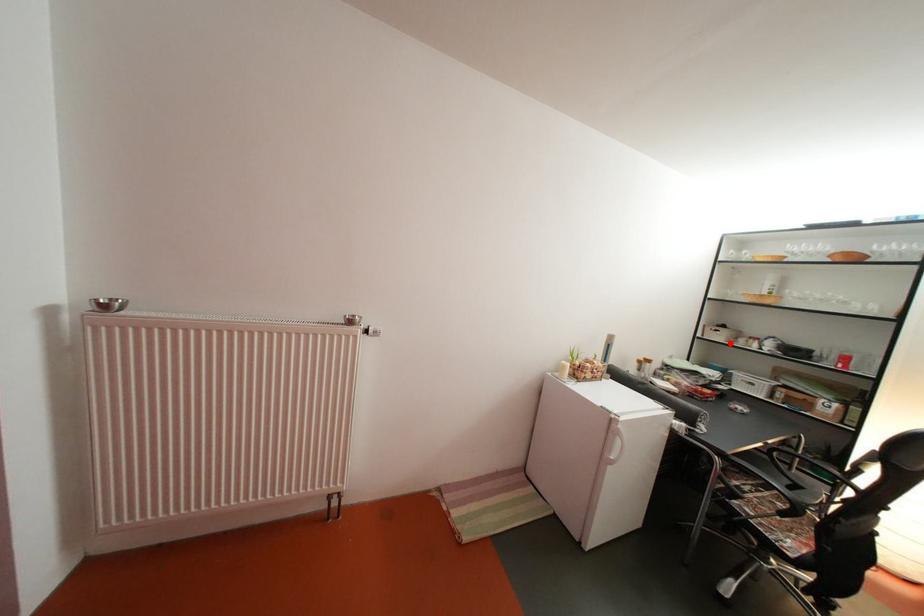
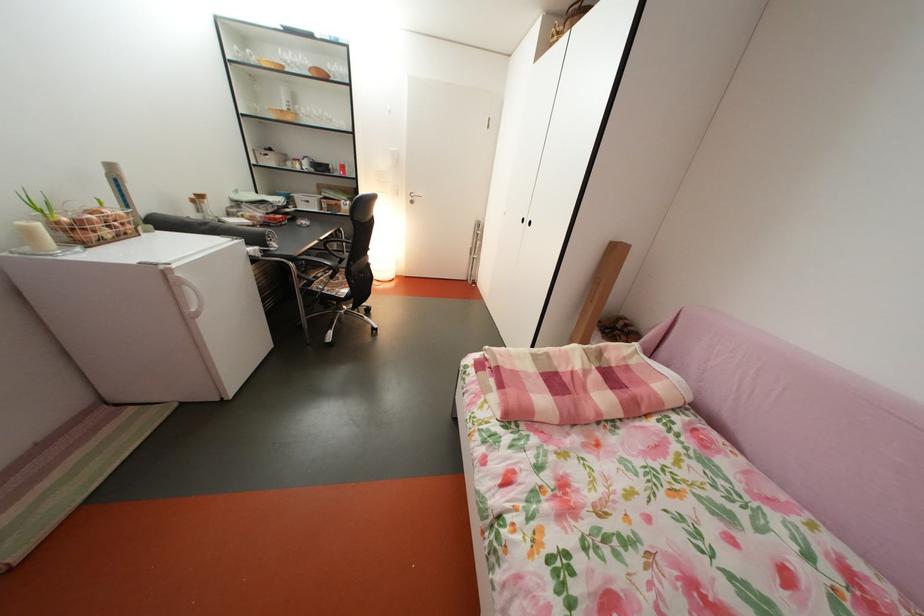
Question: I am providing you with two images of the same scene from different viewpoints. In image1, a red point is highlighted. Considering the same 3D point in image2, which of the following is correct?

Choices:
 (A) It is closer
 (B) It is farther

Answer: (A)